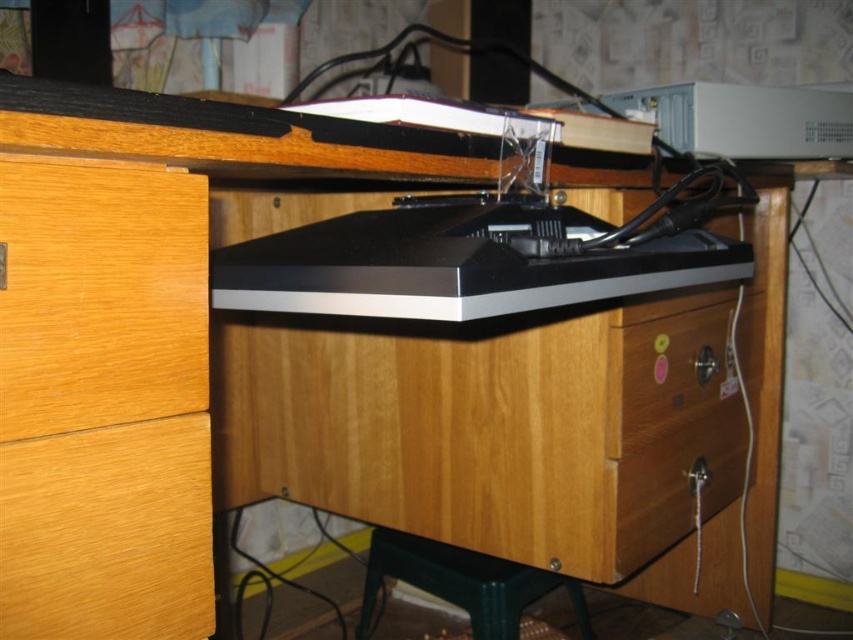
You are standing in front of the wooden desk and want to locate the wooden drawer at lower right. Where exactly should you look?

The wooden drawer at lower right is located at point 0.795 on the x axis and 0.756 on the y axis.